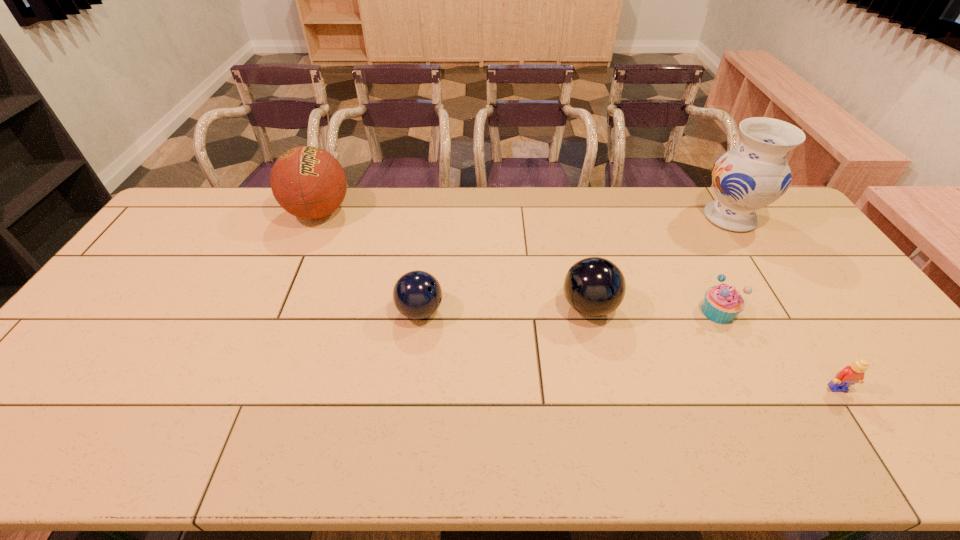
Identify the location of vase. This screenshot has height=540, width=960. (754, 174).

Locate an element on the screen. the fifth shortest object is located at coordinates (308, 182).

The image size is (960, 540). In order to click on basketball in this screenshot , I will do `click(308, 182)`.

Find the location of a particular element. The width and height of the screenshot is (960, 540). the fourth shortest object is located at coordinates coord(594,286).

The width and height of the screenshot is (960, 540). In order to click on the fourth object from right to left in this screenshot , I will do `click(594, 286)`.

You are a GUI agent. You are given a task and a screenshot of the screen. Output one action in this format:
    pyautogui.click(x=<x>, y=<y>)
    Task: Click on the left bowling ball
    The width and height of the screenshot is (960, 540).
    Given the screenshot: What is the action you would take?
    pyautogui.click(x=417, y=294)

Where is `the fourth tallest object`? Image resolution: width=960 pixels, height=540 pixels. the fourth tallest object is located at coordinates (417, 294).

Find the location of a particular element. Image resolution: width=960 pixels, height=540 pixels. the fourth object from left to right is located at coordinates (722, 303).

Where is `Lego`? This screenshot has height=540, width=960. Lego is located at coordinates (852, 374).

I want to click on vacant region located 0.070m on the front of the tallest object, so click(x=753, y=253).